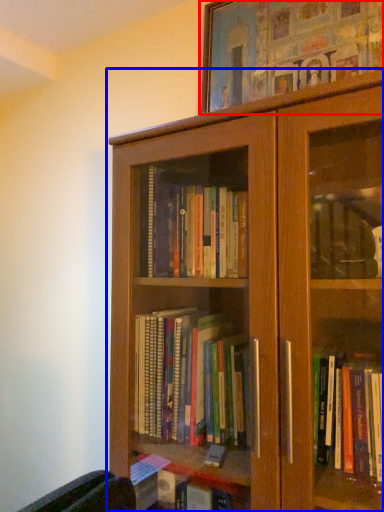
Question: Which object appears farthest to the camera in this image, picture frame (highlighted by a red box) or bookcase (highlighted by a blue box)?

Choices:
 (A) picture frame
 (B) bookcase

Answer: (A)